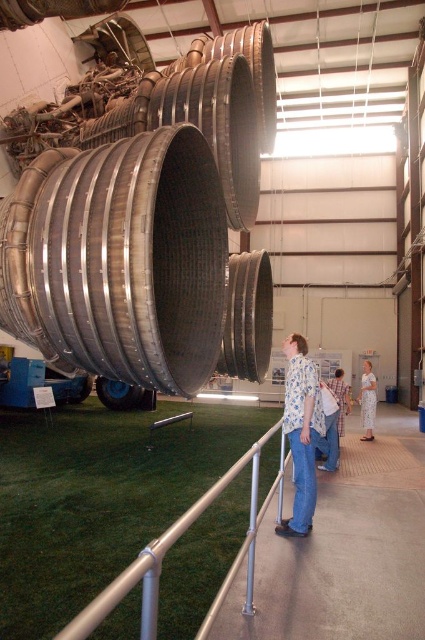
Question: Can you confirm if silver metallic rail at center is positioned below floral shirt at center?

Choices:
 (A) yes
 (B) no

Answer: (B)

Question: Which point is closer to the camera?

Choices:
 (A) silver metallic rail at center
 (B) floral shirt at center
 (C) blue plaid shirt at center

Answer: (A)

Question: Which object appears closest to the camera in this image?

Choices:
 (A) white floral dress at center
 (B) silver metallic rail at center

Answer: (B)

Question: Is silver metallic rail at center above floral shirt at center?

Choices:
 (A) no
 (B) yes

Answer: (B)

Question: Is silver metallic rail at center to the right of white floral dress at center from the viewer's perspective?

Choices:
 (A) no
 (B) yes

Answer: (A)

Question: Which point is closer to the camera taking this photo?

Choices:
 (A) pyautogui.click(x=218, y=493)
 (B) pyautogui.click(x=365, y=419)

Answer: (A)